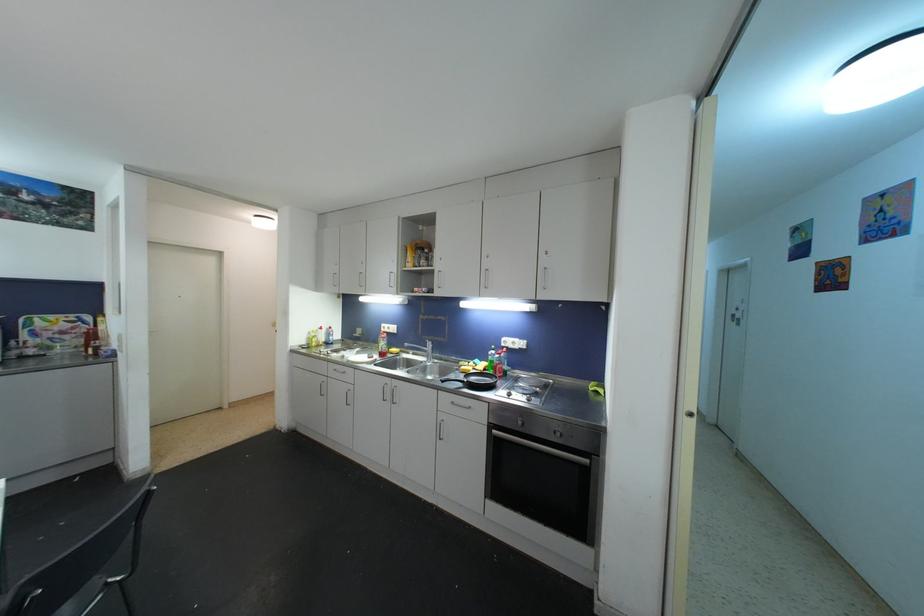
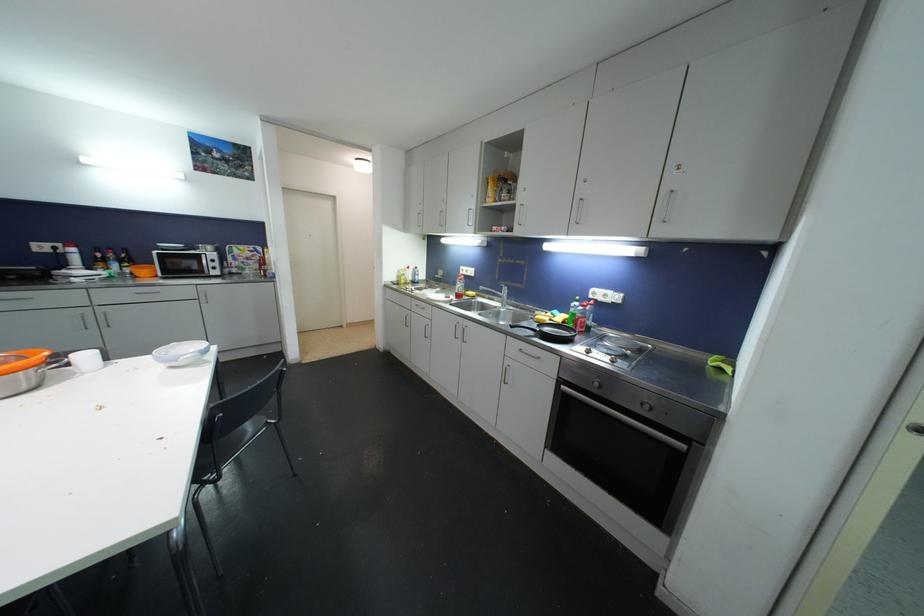
In the second image, find the point that corresponds to (427,339) in the first image.

(504, 285)